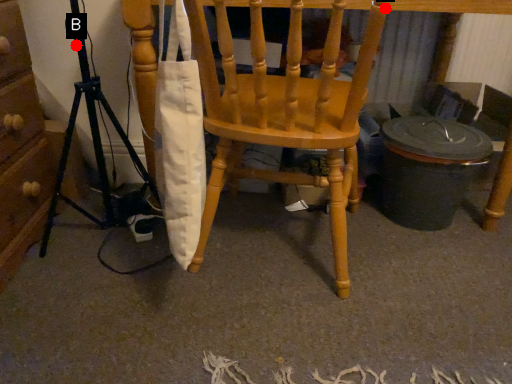
Question: Two points are circled on the image, labeled by A and B beside each circle. Among these points, which one is farthest from the camera?

Choices:
 (A) A is further
 (B) B is further

Answer: (B)